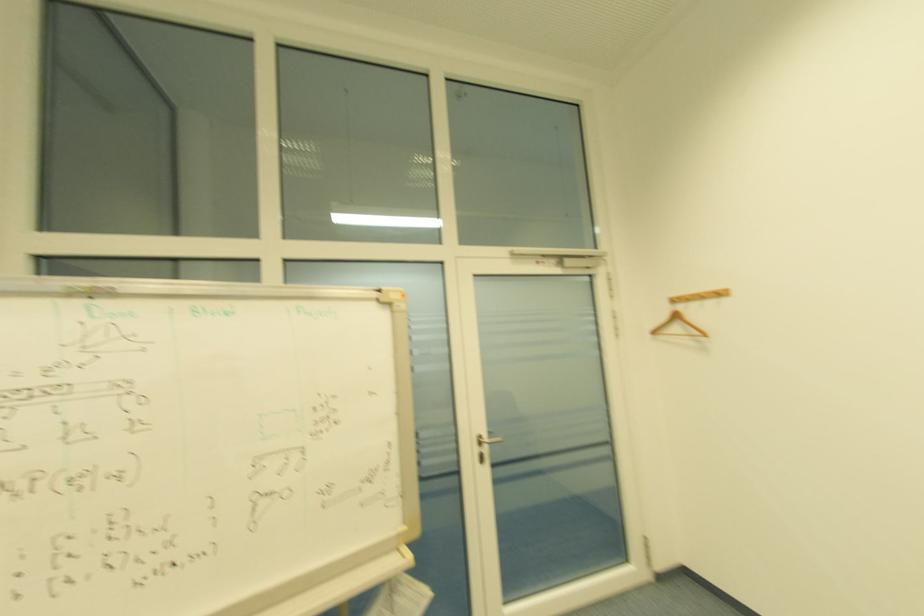
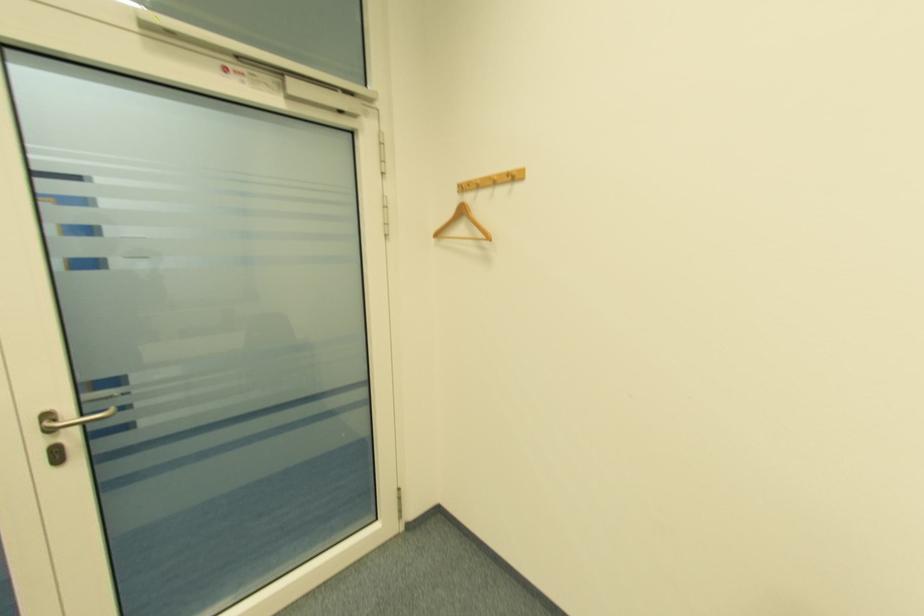
What movement of the cameraman would produce the second image?

The cameraman walked toward right, forward.